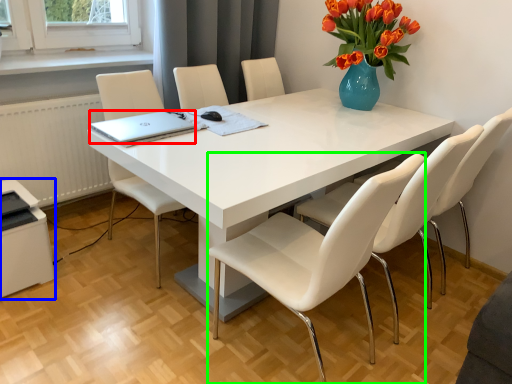
Question: Based on their relative distances, which object is nearer to laptop (highlighted by a red box)? Choose from printer (highlighted by a blue box) and chair (highlighted by a green box).

Choices:
 (A) printer
 (B) chair

Answer: (A)